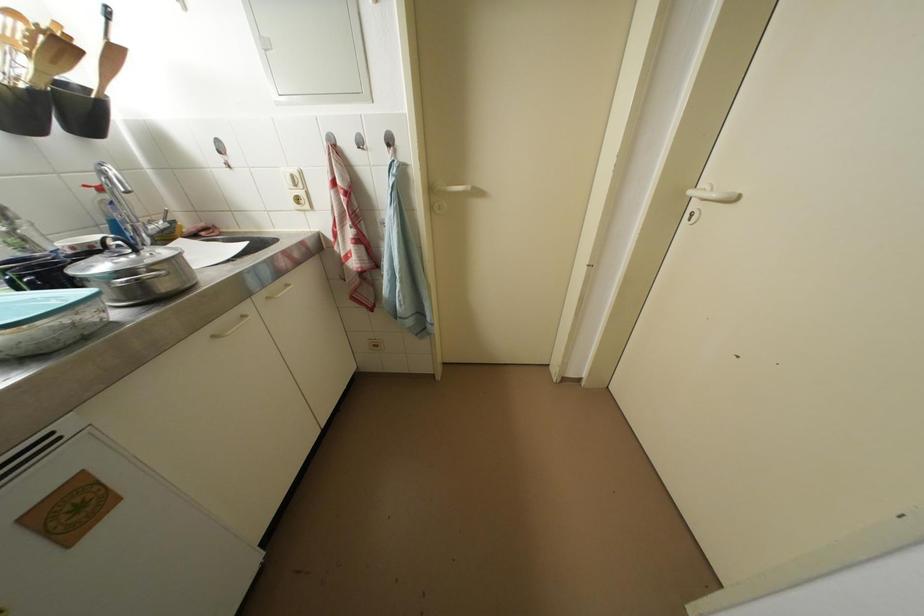
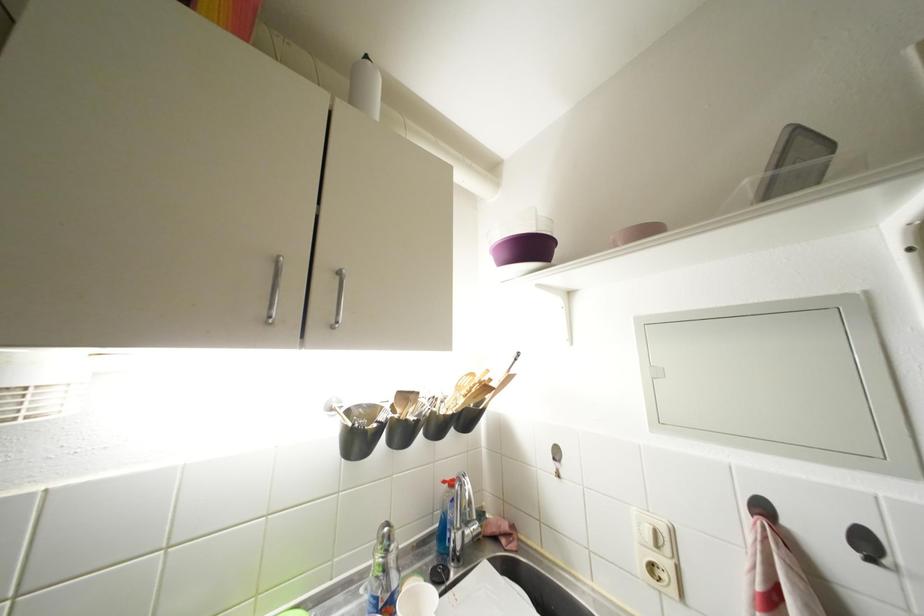
Locate, in the second image, the point that corresponds to point (301, 188) in the first image.

(663, 549)